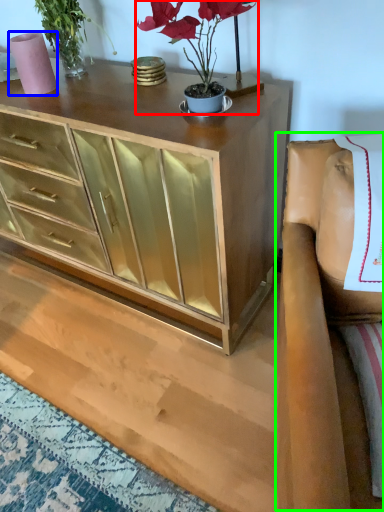
Question: Which is farther away from houseplant (highlighted by a red box)? vase (highlighted by a blue box) or armchair (highlighted by a green box)?

Choices:
 (A) vase
 (B) armchair

Answer: (A)